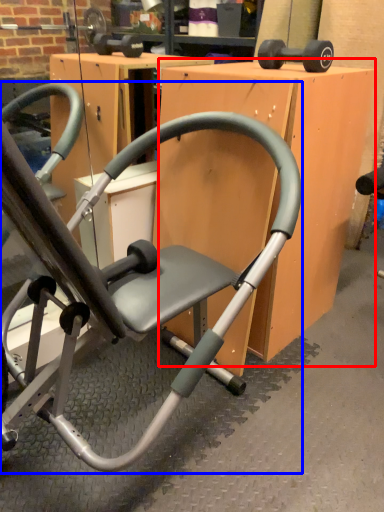
Question: Which point is further to the camera, table (highlighted by a red box) or chair (highlighted by a blue box)?

Choices:
 (A) table
 (B) chair

Answer: (A)